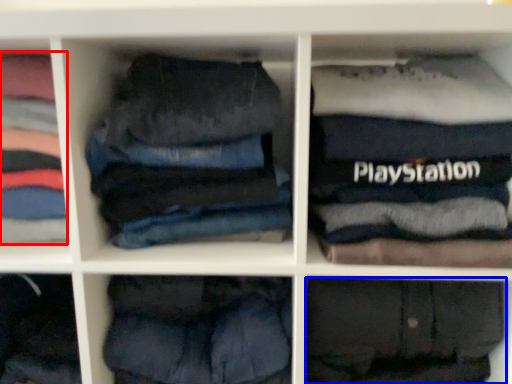
Question: Which point is closer to the camera, clothing (highlighted by a red box) or trousers (highlighted by a blue box)?

Choices:
 (A) clothing
 (B) trousers

Answer: (B)